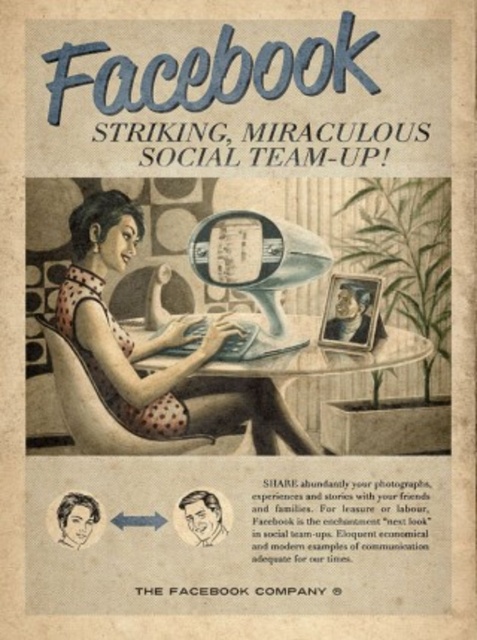
Question: Can you confirm if polka dot fabric dress at center is positioned above translucent glass table at center?

Choices:
 (A) yes
 (B) no

Answer: (A)

Question: Among these objects, which one is farthest from the camera?

Choices:
 (A) polka dot fabric dress at center
 (B) translucent glass table at center

Answer: (B)

Question: Considering the relative positions of polka dot fabric dress at center and translucent glass table at center in the image provided, where is polka dot fabric dress at center located with respect to translucent glass table at center?

Choices:
 (A) above
 (B) below

Answer: (A)

Question: Which point is farther from the camera taking this photo?

Choices:
 (A) (173, 326)
 (B) (273, 369)

Answer: (B)

Question: Is polka dot fabric dress at center positioned behind translucent glass table at center?

Choices:
 (A) no
 (B) yes

Answer: (A)